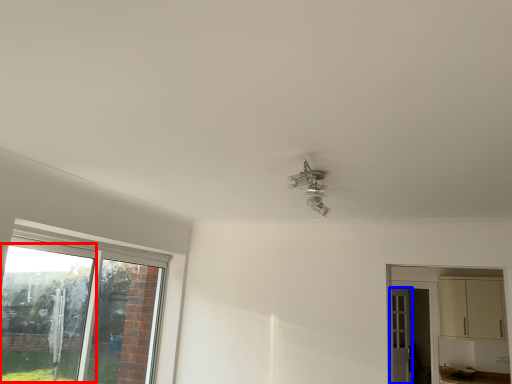
Question: Which point is closer to the camera, window screen (highlighted by a red box) or door (highlighted by a blue box)?

Choices:
 (A) window screen
 (B) door

Answer: (A)